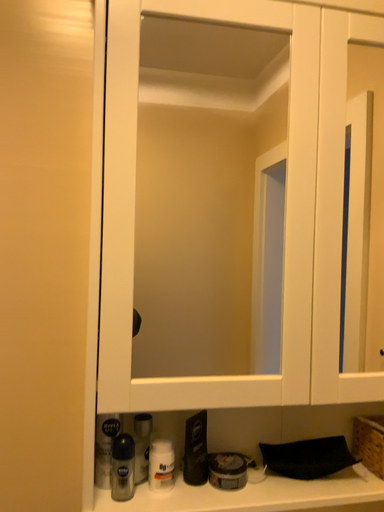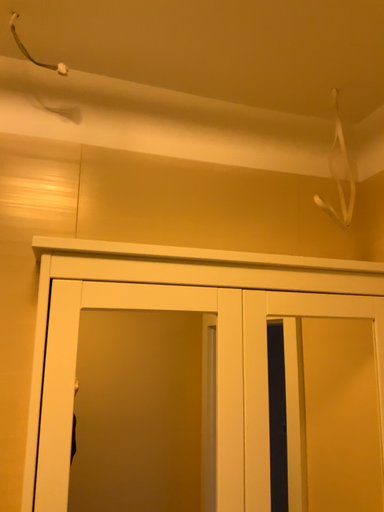
Question: Which way did the camera rotate in the video?

Choices:
 (A) rotated downward
 (B) rotated upward

Answer: (B)